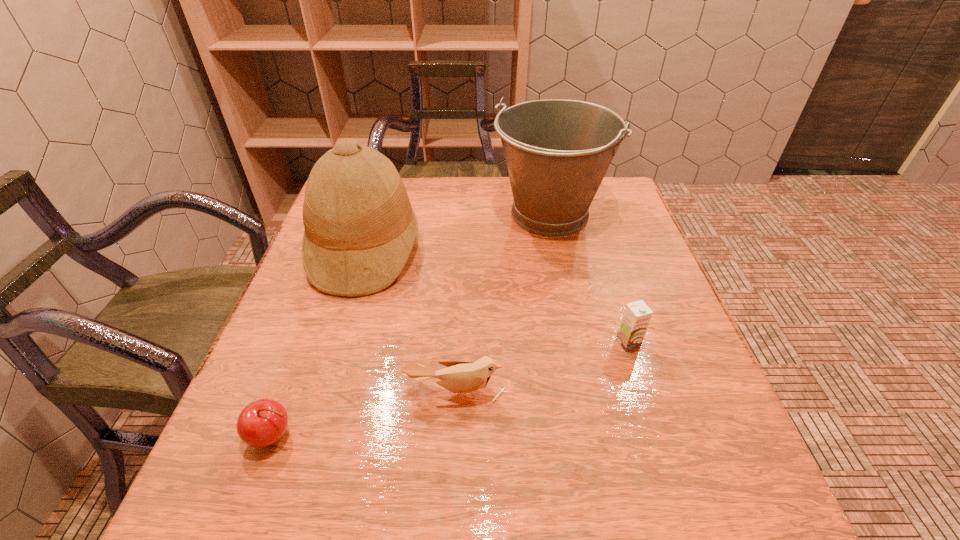
Where is `vacant space that's between the third farthest object and the second nearest object`? This screenshot has width=960, height=540. vacant space that's between the third farthest object and the second nearest object is located at coordinates (542, 368).

Identify the location of vacant space that's between the hat and the bird. pyautogui.click(x=411, y=321).

Find the location of a particular element. This screenshot has height=540, width=960. the closest object to the third farthest object is located at coordinates (460, 376).

Locate an element on the screen. object that is the fourth closest one to the bucket is located at coordinates (263, 422).